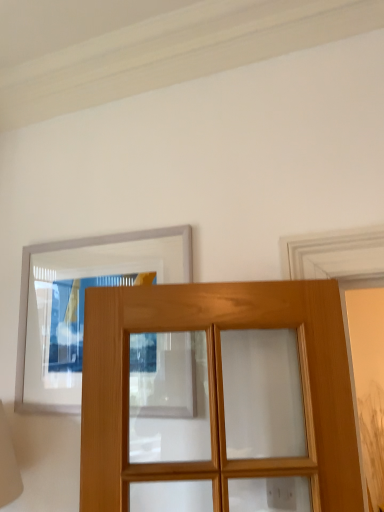
What do you see at coordinates (80, 304) in the screenshot?
I see `white matte picture frame at upper left` at bounding box center [80, 304].

What are the coordinates of `white matte picture frame at upper left` in the screenshot? It's located at (80, 304).

What is the approximate height of white matte picture frame at upper left?

26.26 inches.

Measure the distance between point (25, 292) and camera.

Point (25, 292) is 1.78 meters away from camera.

This screenshot has height=512, width=384. Identify the location of white matte picture frame at upper left. (80, 304).